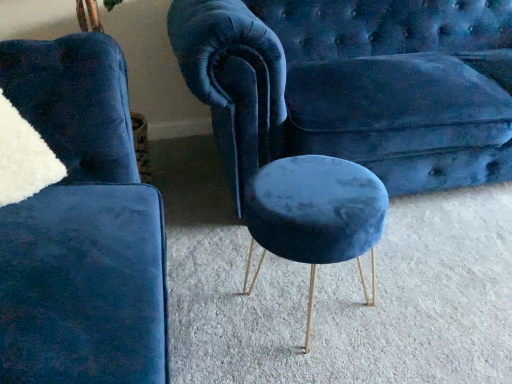
Question: Can you confirm if velvet blue stool at center is positioned to the left of velvet blue stool at lower left?

Choices:
 (A) no
 (B) yes

Answer: (A)

Question: Does velvet blue stool at center have a lesser height compared to velvet blue stool at lower left?

Choices:
 (A) yes
 (B) no

Answer: (A)

Question: Can you confirm if velvet blue stool at center is bigger than velvet blue stool at lower left?

Choices:
 (A) no
 (B) yes

Answer: (A)

Question: From the image's perspective, does velvet blue stool at center appear lower than velvet blue stool at lower left?

Choices:
 (A) yes
 (B) no

Answer: (A)

Question: From the image's perspective, is velvet blue stool at center on velvet blue stool at lower left?

Choices:
 (A) yes
 (B) no

Answer: (B)

Question: Based on their sizes in the image, would you say velvet blue stool at center is bigger or smaller than velvet blue stool at lower left?

Choices:
 (A) small
 (B) big

Answer: (A)

Question: Is velvet blue stool at center inside or outside of velvet blue stool at lower left?

Choices:
 (A) inside
 (B) outside

Answer: (B)

Question: Is point (371, 200) closer or farther from the camera than point (71, 334)?

Choices:
 (A) closer
 (B) farther

Answer: (B)

Question: From the image's perspective, relative to velvet blue stool at lower left, is velvet blue stool at center above or below?

Choices:
 (A) above
 (B) below

Answer: (B)

Question: Looking at the image, does velvet blue stool at lower left seem bigger or smaller compared to velvet blue couch at center?

Choices:
 (A) big
 (B) small

Answer: (B)

Question: Based on their positions, is velvet blue stool at lower left located to the left or right of velvet blue couch at center?

Choices:
 (A) left
 (B) right

Answer: (A)

Question: From the image's perspective, is velvet blue stool at lower left positioned above or below velvet blue couch at center?

Choices:
 (A) above
 (B) below

Answer: (B)

Question: Is point (38, 84) closer or farther from the camera than point (448, 127)?

Choices:
 (A) farther
 (B) closer

Answer: (B)

Question: In terms of size, does velvet blue stool at center appear bigger or smaller than velvet blue couch at center?

Choices:
 (A) big
 (B) small

Answer: (B)

Question: From a real-world perspective, relative to velvet blue couch at center, is velvet blue stool at center vertically above or below?

Choices:
 (A) below
 (B) above

Answer: (A)